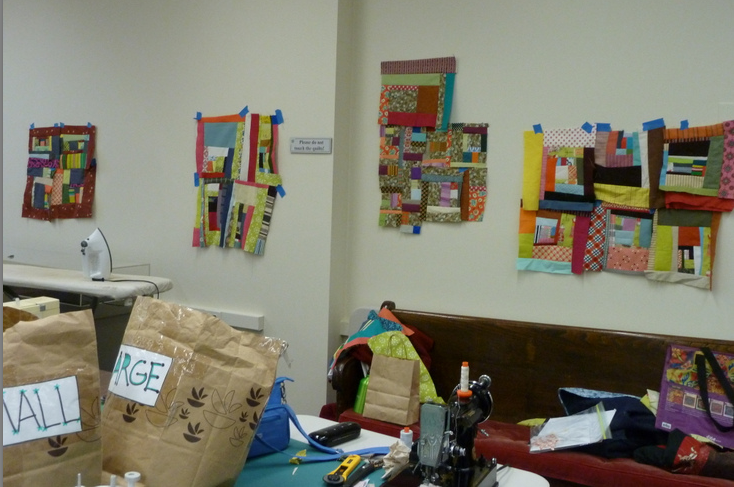
This screenshot has width=734, height=487. What are the coordinates of `black cord` in the screenshot? It's located at (131, 281).